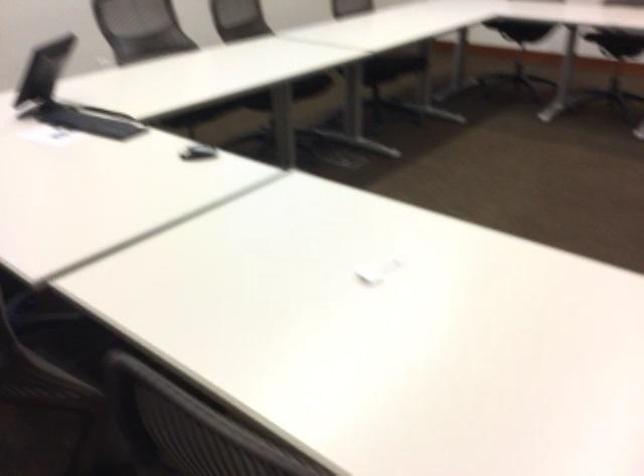
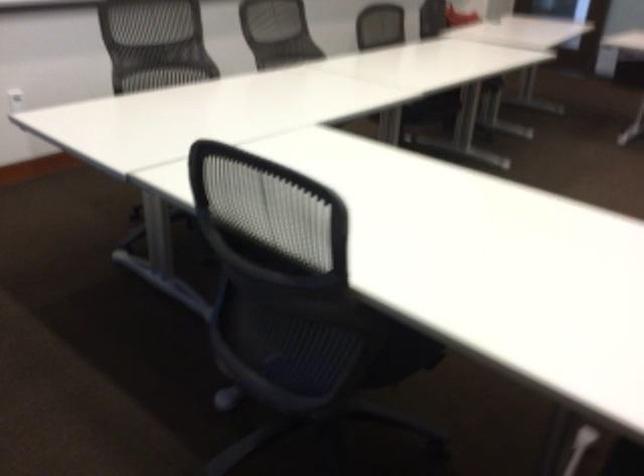
Question: Which direction would the cameraman need to move to produce the second image? Reply with the corresponding letter.

Choices:
 (A) Left
 (B) Right
 (C) Forward
 (D) Backward

Answer: (D)